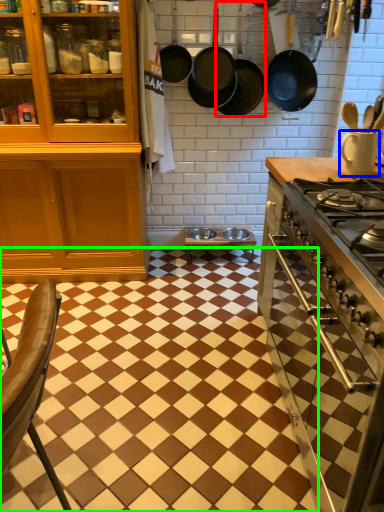
Question: Which is nearer to the frying pan (highlighted by a red box)? kitchen appliance (highlighted by a blue box) or tile (highlighted by a green box).

Choices:
 (A) kitchen appliance
 (B) tile

Answer: (A)